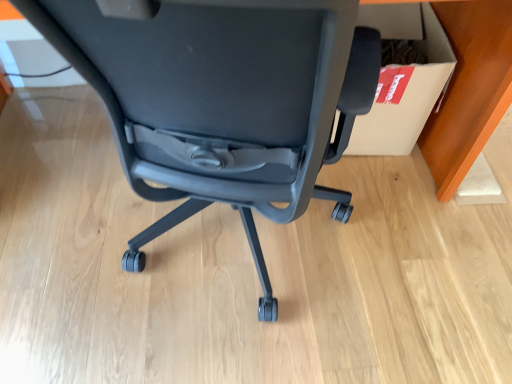
Where is `white cardboard box at right`? This screenshot has width=512, height=384. white cardboard box at right is located at coordinates (403, 80).

This screenshot has height=384, width=512. What do you see at coordinates (403, 80) in the screenshot?
I see `white cardboard box at right` at bounding box center [403, 80].

Find the location of `matte black chair at center`. matte black chair at center is located at coordinates (222, 100).

What do you see at coordinates (222, 100) in the screenshot? The width and height of the screenshot is (512, 384). I see `matte black chair at center` at bounding box center [222, 100].

Identify the location of white cardboard box at right. The image size is (512, 384). (403, 80).

Which object is positioned more to the left, white cardboard box at right or matte black chair at center?

From the viewer's perspective, matte black chair at center appears more on the left side.

Relative to matte black chair at center, is white cardboard box at right in front or behind?

Visually, white cardboard box at right is located behind matte black chair at center.

Does point (422, 33) appear closer or farther from the camera than point (184, 107)?

Point (422, 33) is positioned farther from the camera compared to point (184, 107).

From the image's perspective, which object appears higher, white cardboard box at right or matte black chair at center?

white cardboard box at right appears higher in the image.

Based on the photo, from a real-world perspective, is white cardboard box at right positioned above or below matte black chair at center?

Clearly, from a real-world perspective, white cardboard box at right is below matte black chair at center.

Which of these two, white cardboard box at right or matte black chair at center, is thinner?

With smaller width is white cardboard box at right.

In terms of height, does white cardboard box at right look taller or shorter compared to matte black chair at center?

Clearly, white cardboard box at right is shorter compared to matte black chair at center.

Considering the sizes of white cardboard box at right and matte black chair at center in the image, is white cardboard box at right bigger or smaller than matte black chair at center?

Considering their sizes, white cardboard box at right takes up less space than matte black chair at center.

Would you say white cardboard box at right is inside or outside matte black chair at center?

white cardboard box at right cannot be found inside matte black chair at center.

Is white cardboard box at right directly adjacent to matte black chair at center?

There is a gap between white cardboard box at right and matte black chair at center.

Could you tell me if white cardboard box at right is facing matte black chair at center?

No, white cardboard box at right is not facing towards matte black chair at center.

How different are the orientations of white cardboard box at right and matte black chair at center in degrees?

The angle between the facing direction of white cardboard box at right and the facing direction of matte black chair at center is 170 degrees.

What are the coordinates of `chair in front of the white cardboard box at right` in the screenshot? It's located at (222, 100).

Considering the positions of objects matte black chair at center and white cardboard box at right in the image provided, who is more to the left, matte black chair at center or white cardboard box at right?

matte black chair at center.

Which object is further away from the camera, matte black chair at center or white cardboard box at right?

white cardboard box at right is more distant.

Does point (214, 200) lie in front of point (409, 143)?

Yes, it is in front of point (409, 143).

From the image's perspective, who appears lower, matte black chair at center or white cardboard box at right?

matte black chair at center, from the image's perspective.

From a real-world perspective, does matte black chair at center stand above white cardboard box at right?

Yes, from a real-world perspective, matte black chair at center is over white cardboard box at right

Which of these two, matte black chair at center or white cardboard box at right, is wider?

matte black chair at center.

Between matte black chair at center and white cardboard box at right, which one has less height?

white cardboard box at right.

Is matte black chair at center bigger than white cardboard box at right?

Indeed, matte black chair at center has a larger size compared to white cardboard box at right.

Is matte black chair at center not inside white cardboard box at right?

matte black chair at center lies outside white cardboard box at right's area.

Are matte black chair at center and white cardboard box at right beside each other?

No, matte black chair at center is not making contact with white cardboard box at right.

Is white cardboard box at right at the back of matte black chair at center?

No, matte black chair at center is not facing the opposite direction of white cardboard box at right.

What's the angular difference between matte black chair at center and white cardboard box at right's facing directions?

matte black chair at center and white cardboard box at right are facing 170 degrees away from each other.

What are the coordinates of `chair in front of the white cardboard box at right` in the screenshot? It's located at (222, 100).

Where is `chair above the white cardboard box at right (from a real-world perspective)`? This screenshot has height=384, width=512. chair above the white cardboard box at right (from a real-world perspective) is located at coordinates (222, 100).

I want to click on cardboard box on the right side of matte black chair at center, so click(403, 80).